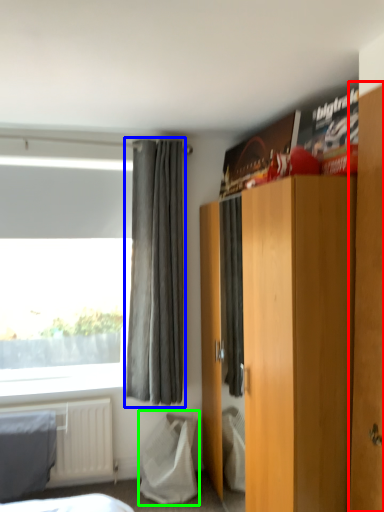
Question: Based on their relative distances, which object is nearer to armoire (highlighted by a red box)? Choose from curtain (highlighted by a blue box) and sheet (highlighted by a green box).

Choices:
 (A) curtain
 (B) sheet

Answer: (A)